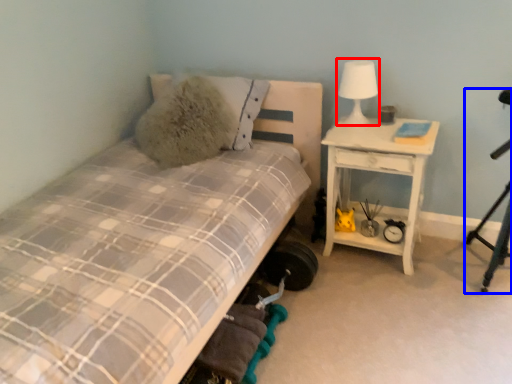
Question: Which point is further to the camera, table lamp (highlighted by a red box) or tripod (highlighted by a blue box)?

Choices:
 (A) table lamp
 (B) tripod

Answer: (A)